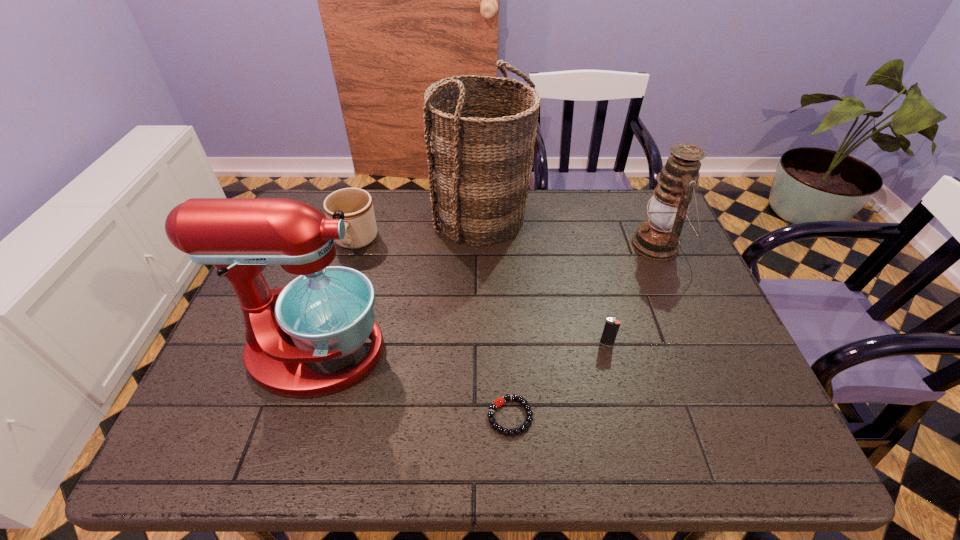
This screenshot has width=960, height=540. I want to click on vacant space that's between the bracelet and the third tallest object, so click(584, 330).

The width and height of the screenshot is (960, 540). In order to click on vacant area that lies between the fourth tallest object and the basket in this screenshot , I will do `click(419, 230)`.

At what (x,y) coordinates should I click in order to perform the action: click on vacant area that lies between the mug and the basket. Please return your answer as a coordinate pair (x, y). Looking at the image, I should click on (419, 230).

I want to click on free space between the mug and the basket, so click(419, 230).

Identify the location of vacant area between the third shortest object and the basket. click(x=419, y=230).

The width and height of the screenshot is (960, 540). Identify the location of free space between the basket and the rightmost object. (569, 231).

Where is `free space between the mug and the basket`? This screenshot has width=960, height=540. free space between the mug and the basket is located at coordinates (419, 230).

Where is `vacant point located between the shortest object and the mug`? The image size is (960, 540). vacant point located between the shortest object and the mug is located at coordinates (432, 329).

At what (x,y) coordinates should I click in order to perform the action: click on object that stands as the second closest to the mixer. Please return your answer as a coordinate pair (x, y). The width and height of the screenshot is (960, 540). Looking at the image, I should click on (511, 432).

Select which object is the closest to the third shortest object. Please provide its 2D coordinates. Your answer should be formatted as a tuple, i.e. [(x, y)], where the tuple contains the x and y coordinates of a point satisfying the conditions above.

[(480, 148)]